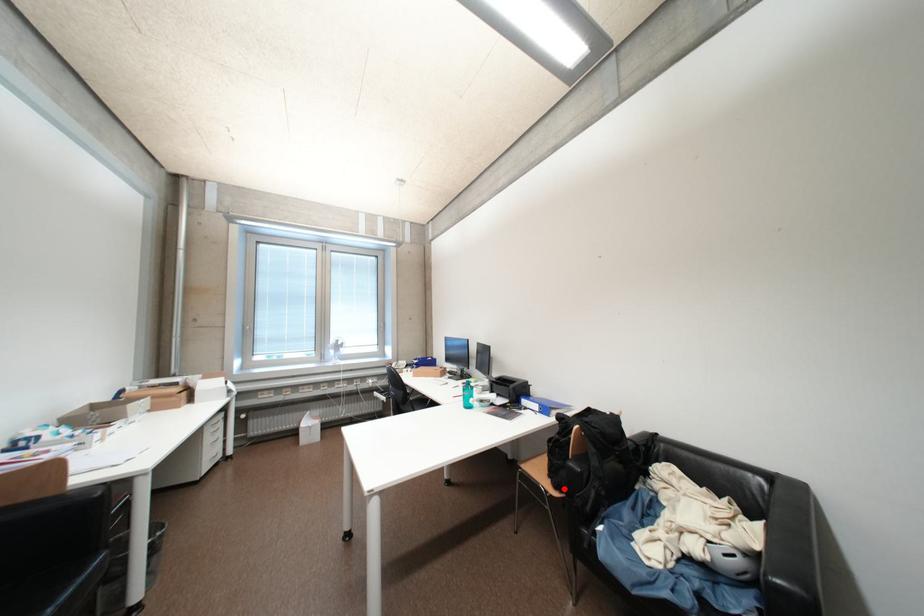
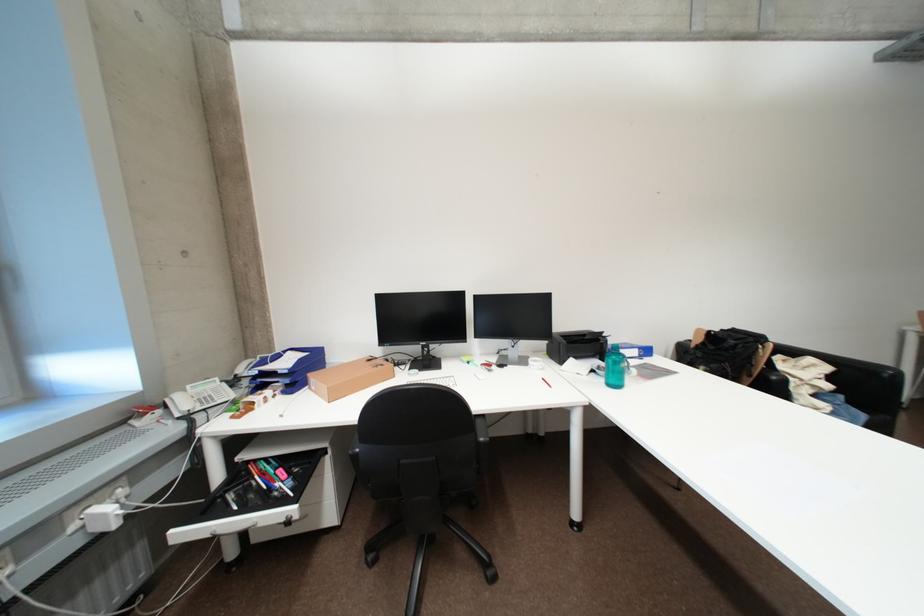
Question: I am providing you with two images of the same scene from different viewpoints. A red point is marked on the first image. Can you still see the location of the red point in image 2?

Choices:
 (A) Yes
 (B) No

Answer: (B)